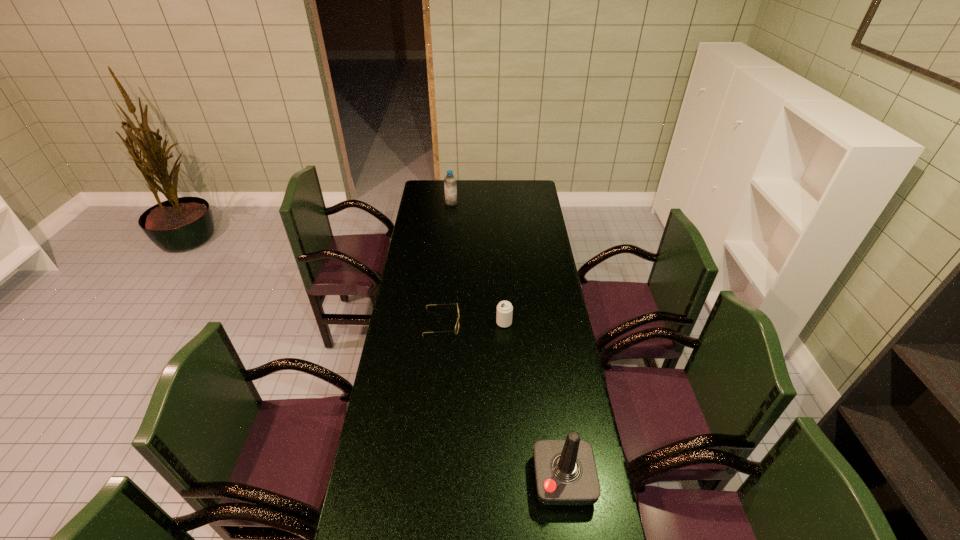
Identify the location of the tallest object. This screenshot has width=960, height=540. (565, 470).

Locate an element on the screen. This screenshot has height=540, width=960. the nearest object is located at coordinates (565, 470).

In order to click on the farthest object in this screenshot , I will do `click(450, 186)`.

You are a GUI agent. You are given a task and a screenshot of the screen. Output one action in this format:
    pyautogui.click(x=<x>, y=<y>)
    Task: Click on the third shortest object
    
    Given the screenshot: What is the action you would take?
    pyautogui.click(x=450, y=186)

What are the coordinates of `the second object from right to left` in the screenshot? It's located at (504, 309).

Locate an element on the screen. The height and width of the screenshot is (540, 960). the third tallest object is located at coordinates (504, 309).

I want to click on the shortest object, so click(x=457, y=324).

What are the coordinates of `vacant space located on the left of the nearest object` in the screenshot? It's located at (407, 480).

Find the location of a particular element. The height and width of the screenshot is (540, 960). vacant space located on the back of the water bottle is located at coordinates (452, 195).

This screenshot has height=540, width=960. I want to click on blank space located on the front of the third tallest object, so click(505, 346).